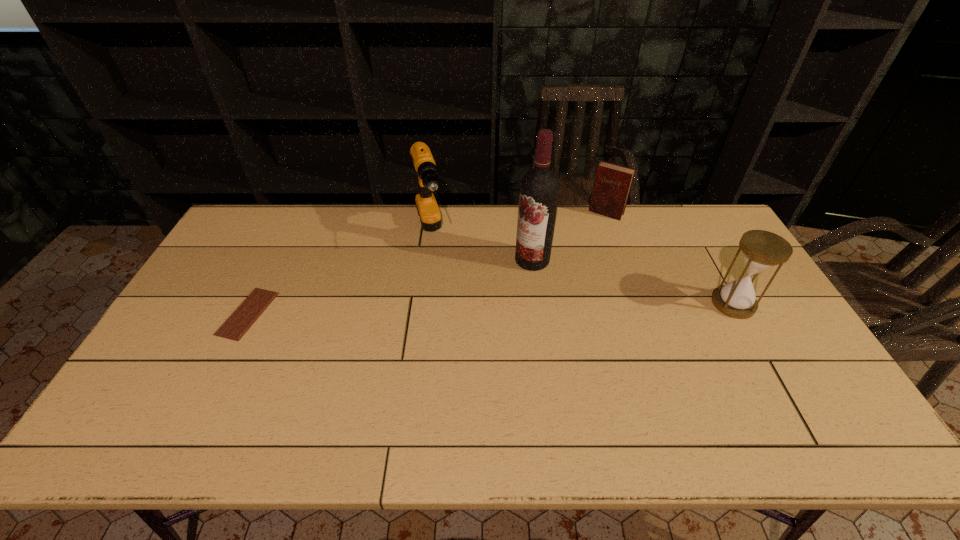
Image resolution: width=960 pixels, height=540 pixels. Identify the location of free space located on the front of the chocolate bar. (223, 363).

Where is `free spot located 0.270m on the left of the hourglass`? This screenshot has height=540, width=960. free spot located 0.270m on the left of the hourglass is located at coordinates (622, 303).

Where is `free point located 0.350m on the label of the third object from right to left`? Image resolution: width=960 pixels, height=540 pixels. free point located 0.350m on the label of the third object from right to left is located at coordinates (423, 312).

You are a GUI agent. You are given a task and a screenshot of the screen. Output one action in this format:
    pyautogui.click(x=<x>, y=<y>)
    Task: Click on the free space located 0.080m on the label of the third object from right to left
    
    Given the screenshot: What is the action you would take?
    pyautogui.click(x=498, y=276)

You are a GUI agent. You are given a task and a screenshot of the screen. Output one action in this format:
    pyautogui.click(x=<x>, y=<y>)
    Task: Click on the vacant space positioned 0.210m on the label of the third object from right to left
    The image size is (960, 540).
    Given the screenshot: What is the action you would take?
    pyautogui.click(x=464, y=292)

Locate an element on the screen. vacant region located at the tip of the drill is located at coordinates (452, 333).

The width and height of the screenshot is (960, 540). I want to click on vacant space situated at the tip of the drill, so click(x=436, y=278).

Identify the location of free region located 0.240m at the tip of the drill. This screenshot has height=540, width=960. [x=448, y=320].

Locate an element on the screen. The image size is (960, 540). free space located 0.260m on the front cover of the diary is located at coordinates (574, 261).

Where is `vacant space located 0.390m on the front cover of the diary`? The height and width of the screenshot is (540, 960). vacant space located 0.390m on the front cover of the diary is located at coordinates (559, 285).